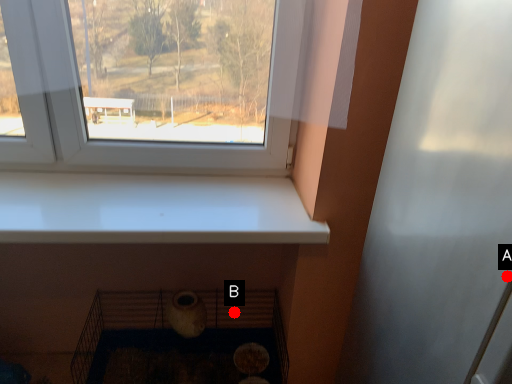
Question: Two points are circled on the image, labeled by A and B beside each circle. Which point appears farthest from the camera in this image?

Choices:
 (A) A is further
 (B) B is further

Answer: (B)